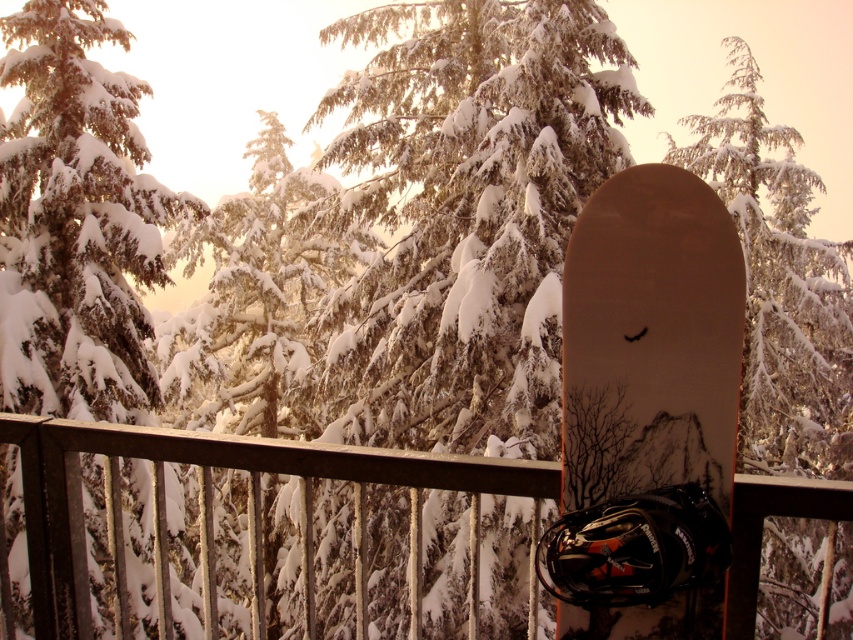
You are a photographer planning to capture the matte brown snowboard at center and the snowy pine tree at center in a single frame. Given their spatial relationship, which object should you focus on first to ensure both are in the frame without moving the camera?

The matte brown snowboard at center occupies less space than the snowy pine tree at center, so you should focus on the snowy pine tree at center first to ensure both fit within the frame.

You are planning to place a 10 meter long decorative banner between the matte brown snowboard at center and the snowy pine tree at center. Can the banner fit between them without overlapping either object?

The distance between the matte brown snowboard at center and the snowy pine tree at center is 7.16 meters. Since the banner is 10 meters long, it is longer than the available space, so the banner cannot fit between them without overlapping either object.